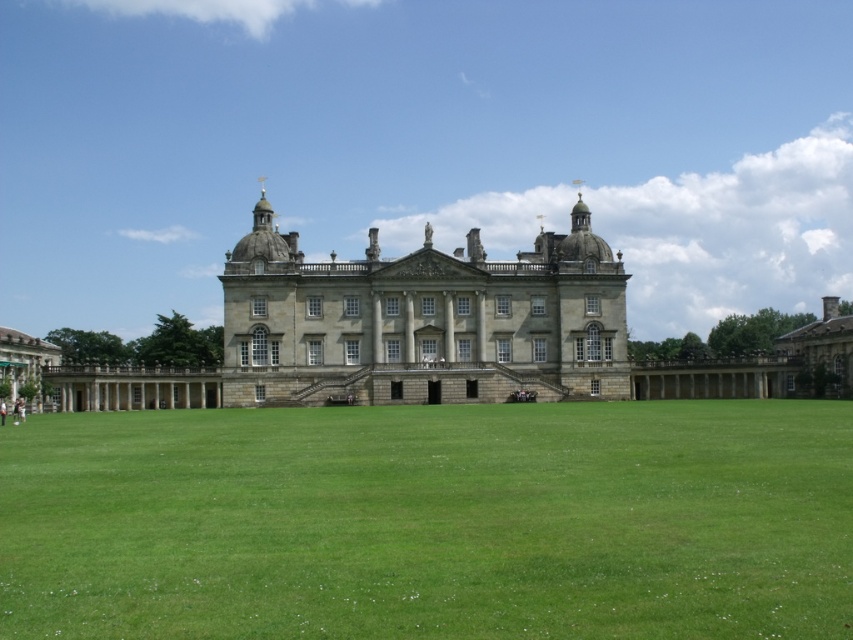
You are standing in front of the historic building and want to take a photo that includes both the point at coordinates point (160, 422) and point (573, 276). Which point should you focus on to ensure both are in sharp focus?

You should focus on the point closer to the camera, which is point (160, 422), to ensure both points are in sharp focus since it is closer and the depth of field will extend backward to include the farther point (573, 276).

You are standing on the green grass at center looking towards the stone gray palace at center. Which object is taller from your perspective?

The stone gray palace at center is taller than the green grass at center.

You are a landscape architect designing a new garden. You have to place a 10m wide statue between the green grass at center and the stone gray palace at center. Which object should the statue be placed closer to so that it fits within the available space?

The green grass at center is wider than the stone gray palace at center. Therefore, placing the statue closer to the stone gray palace at center ensures it fits within the narrower space.